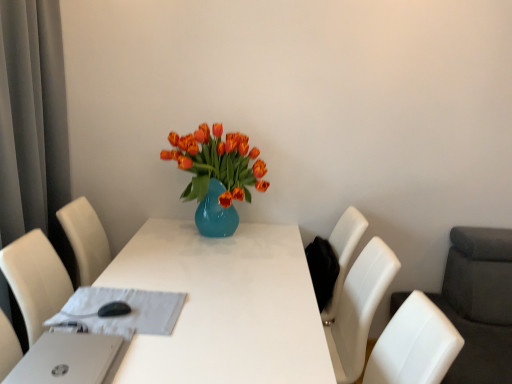
Question: Is white glossy table at center positioned behind white fabric at center?

Choices:
 (A) yes
 (B) no

Answer: (B)

Question: Is white glossy table at center at the left side of white fabric at center?

Choices:
 (A) yes
 (B) no

Answer: (B)

Question: Is white glossy table at center positioned beyond the bounds of white fabric at center?

Choices:
 (A) yes
 (B) no

Answer: (A)

Question: Can you confirm if white glossy table at center is smaller than white fabric at center?

Choices:
 (A) no
 (B) yes

Answer: (A)

Question: Is white glossy table at center facing away from white fabric at center?

Choices:
 (A) yes
 (B) no

Answer: (B)

Question: Considering the positions of gray fabric curtain at left and matte blue vase at center in the image, is gray fabric curtain at left wider or thinner than matte blue vase at center?

Choices:
 (A) thin
 (B) wide

Answer: (A)

Question: Is point (10, 0) closer or farther from the camera than point (264, 185)?

Choices:
 (A) farther
 (B) closer

Answer: (B)

Question: Considering their positions, is gray fabric curtain at left located in front of or behind matte blue vase at center?

Choices:
 (A) behind
 (B) front

Answer: (B)

Question: From a real-world perspective, relative to matte blue vase at center, is gray fabric curtain at left vertically above or below?

Choices:
 (A) above
 (B) below

Answer: (A)

Question: Does point (11, 375) appear closer or farther from the camera than point (33, 107)?

Choices:
 (A) closer
 (B) farther

Answer: (A)

Question: Is white plastic laptop at lower left in front of or behind gray fabric curtain at left in the image?

Choices:
 (A) front
 (B) behind

Answer: (A)

Question: From a real-world perspective, is white plastic laptop at lower left above or below gray fabric curtain at left?

Choices:
 (A) below
 (B) above

Answer: (A)

Question: Looking at their shapes, would you say white plastic laptop at lower left is wider or thinner than gray fabric curtain at left?

Choices:
 (A) thin
 (B) wide

Answer: (B)

Question: Is white glossy table at center in front of or behind matte blue vase at center in the image?

Choices:
 (A) front
 (B) behind

Answer: (A)

Question: From the image's perspective, is white glossy table at center positioned above or below matte blue vase at center?

Choices:
 (A) below
 (B) above

Answer: (A)